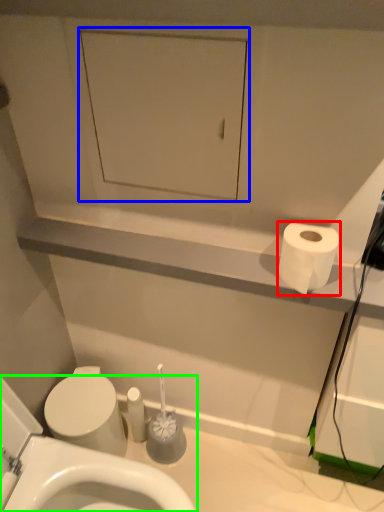
Question: Based on their relative distances, which object is nearer to toilet paper (highlighted by a red box)? Choose from medicine cabinet (highlighted by a blue box) and toilet (highlighted by a green box).

Choices:
 (A) medicine cabinet
 (B) toilet

Answer: (A)